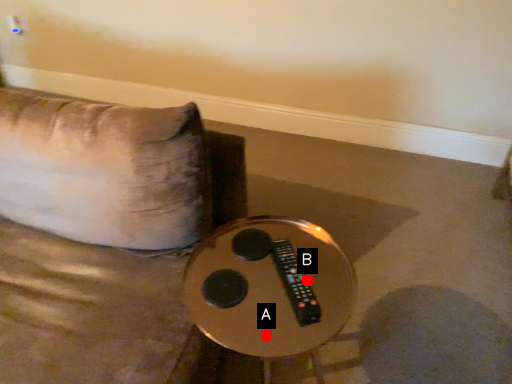
Question: Two points are circled on the image, labeled by A and B beside each circle. Which point is closer to the camera?

Choices:
 (A) A is closer
 (B) B is closer

Answer: (A)